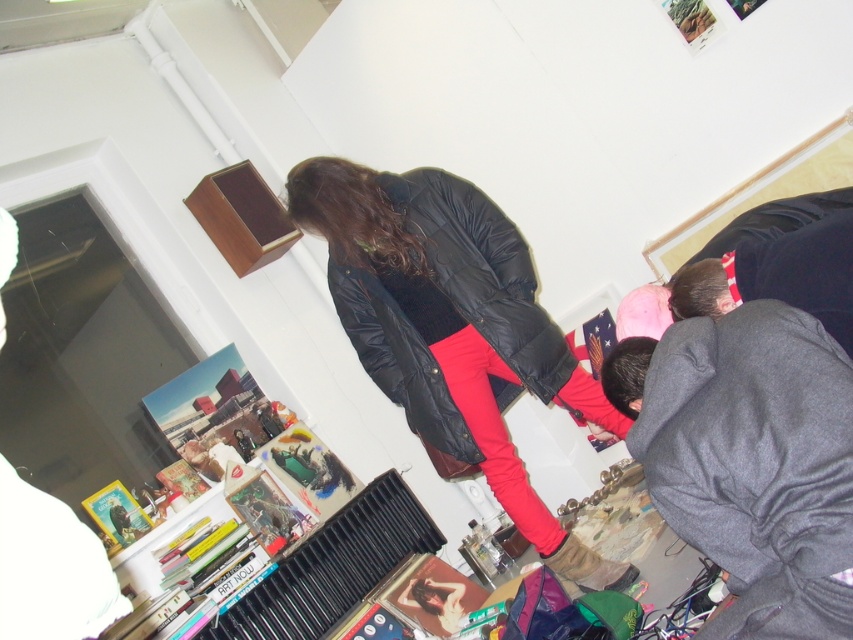
You are standing in the room and need to locate the matte black jacket at center. According to the coordinates provided, where would you find it?

→ The matte black jacket at center is located at coordinates point (451, 330).

You are standing in the room and want to pick up an item that is at one of the two points. Which point, point (850, 508) or point (412, 337), is closer to you?

Point (850, 508) is closer to the camera than point (412, 337), so you should pick up the item at point (850, 508) since it is closer to you.